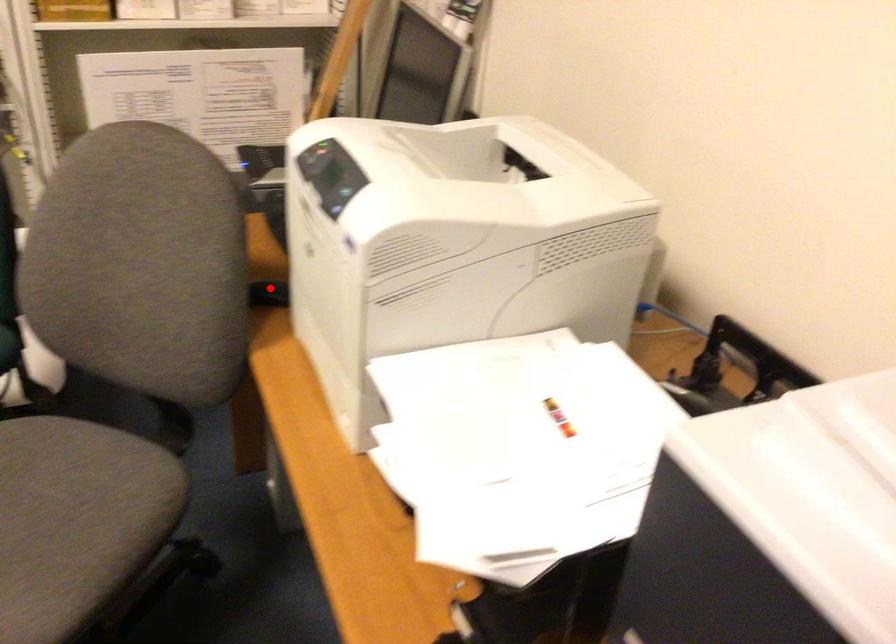
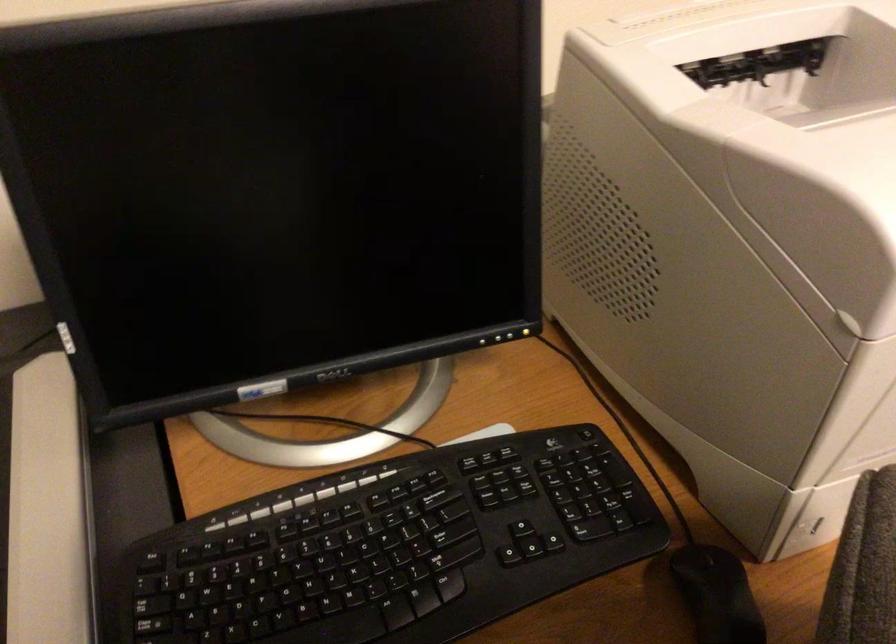
Question: I am providing you with two images of the same scene from different viewpoints. A red point is shown in image1. For the corresponding object point in image2, is it positioned nearer or farther from the camera?

Choices:
 (A) Nearer
 (B) Farther

Answer: (A)